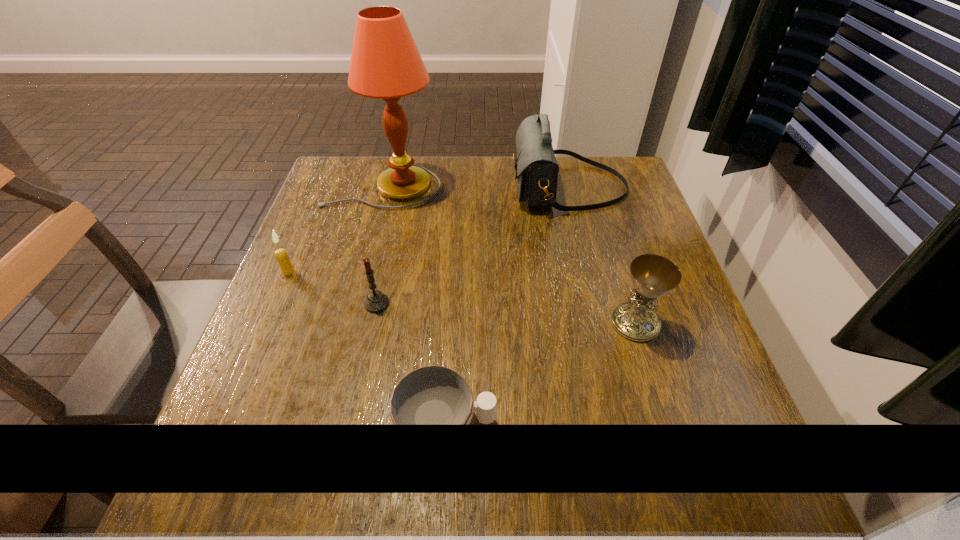
Where is `vacant region located 0.170m on the left of the chalice`? vacant region located 0.170m on the left of the chalice is located at coordinates (524, 323).

Identify the location of free space located on the back of the right candle. (390, 244).

Image resolution: width=960 pixels, height=540 pixels. Find the location of `free space located on the back of the farther candle`. free space located on the back of the farther candle is located at coordinates (306, 230).

Image resolution: width=960 pixels, height=540 pixels. Find the location of `vacant space positioned 0.120m on the side with the handle of the shortest object`. vacant space positioned 0.120m on the side with the handle of the shortest object is located at coordinates (568, 422).

Locate an element on the screen. Image resolution: width=960 pixels, height=540 pixels. lamp at the far edge is located at coordinates (385, 64).

Locate an element on the screen. Image resolution: width=960 pixels, height=540 pixels. shoulder bag that is at the far edge is located at coordinates (536, 167).

The width and height of the screenshot is (960, 540). I want to click on object present at the near edge, so tap(433, 395).

Identify the location of lamp that is at the left edge. (385, 64).

Find the location of a particular element. candle that is positioned at the left edge is located at coordinates (281, 255).

Identify the location of shoulder bag located in the right edge section of the desktop. (536, 167).